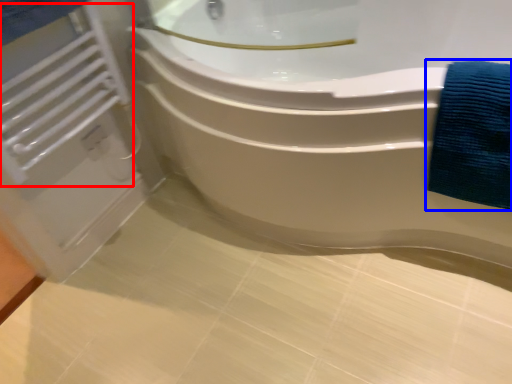
Question: Which object is further to the camera taking this photo, radiator (highlighted by a red box) or bath towel (highlighted by a blue box)?

Choices:
 (A) radiator
 (B) bath towel

Answer: (A)